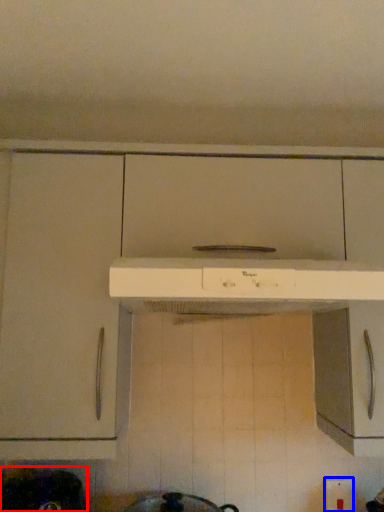
Question: Which of the following is the closest to the observer, appliance (highlighted by a red box) or electric outlet (highlighted by a blue box)?

Choices:
 (A) appliance
 (B) electric outlet

Answer: (A)